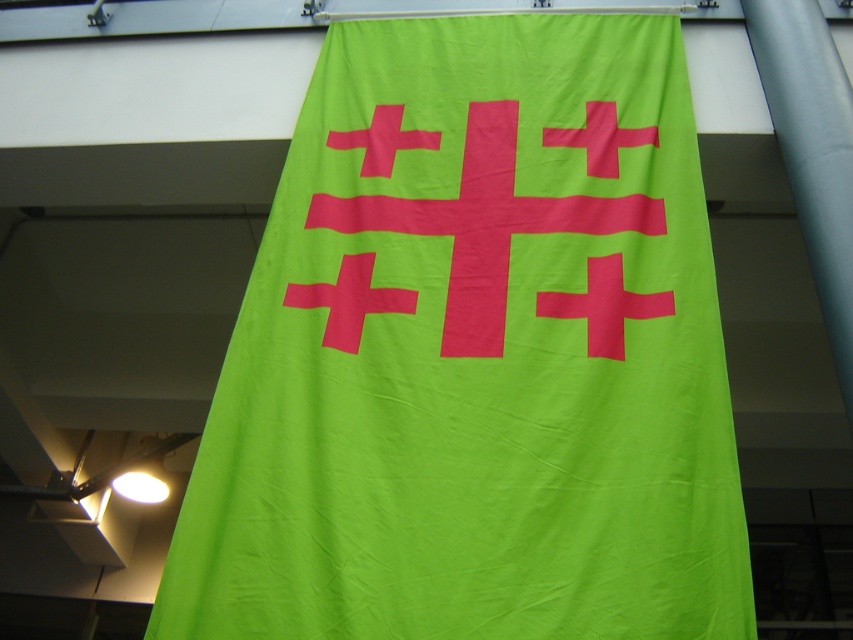
Question: Among these objects, which one is nearest to the camera?

Choices:
 (A) bright pink fabric cross at center
 (B) lime green fabric flag at center

Answer: (B)

Question: Does lime green fabric flag at center come in front of bright pink fabric cross at center?

Choices:
 (A) yes
 (B) no

Answer: (A)

Question: From the image, what is the correct spatial relationship of lime green fabric flag at center in relation to bright pink fabric cross at center?

Choices:
 (A) right
 (B) left

Answer: (B)

Question: Does lime green fabric flag at center come behind bright pink fabric cross at center?

Choices:
 (A) no
 (B) yes

Answer: (A)